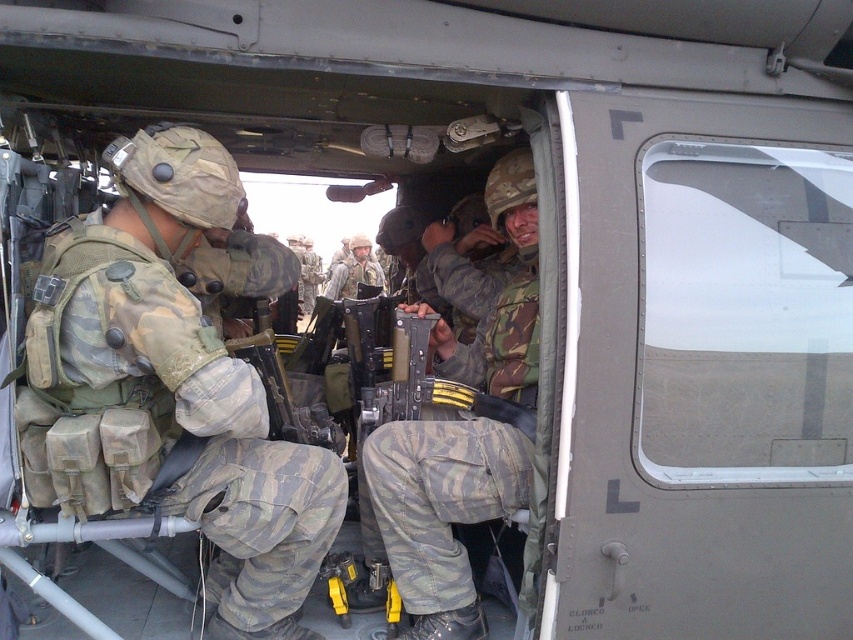
Which is above, camouflage fabric uniform at center or camouflage fabric helmet at center?

camouflage fabric helmet at center is above.

Between point (199, 470) and point (502, 184), which one is positioned behind?

The point (502, 184) is more distant.

Based on the photo, who is more forward, [213,378] or [450,344]?

Point [213,378] is more forward.

Where is `camouflage fabric uniform at center`? camouflage fabric uniform at center is located at coordinates (178, 376).

Can you confirm if camouflage fabric helmet at center is bigger than camouflage uniform at center?

Correct, camouflage fabric helmet at center is larger in size than camouflage uniform at center.

Which is in front, point (374, 454) or point (329, 291)?

Point (374, 454) is more forward.

I want to click on camouflage fabric helmet at center, so click(x=442, y=509).

Between camouflage fabric uniform at center and camouflage uniform at center, which one is positioned higher?

camouflage uniform at center is higher up.

Can you confirm if camouflage fabric uniform at center is positioned below camouflage uniform at center?

Yes.

I want to click on camouflage fabric uniform at center, so click(x=178, y=376).